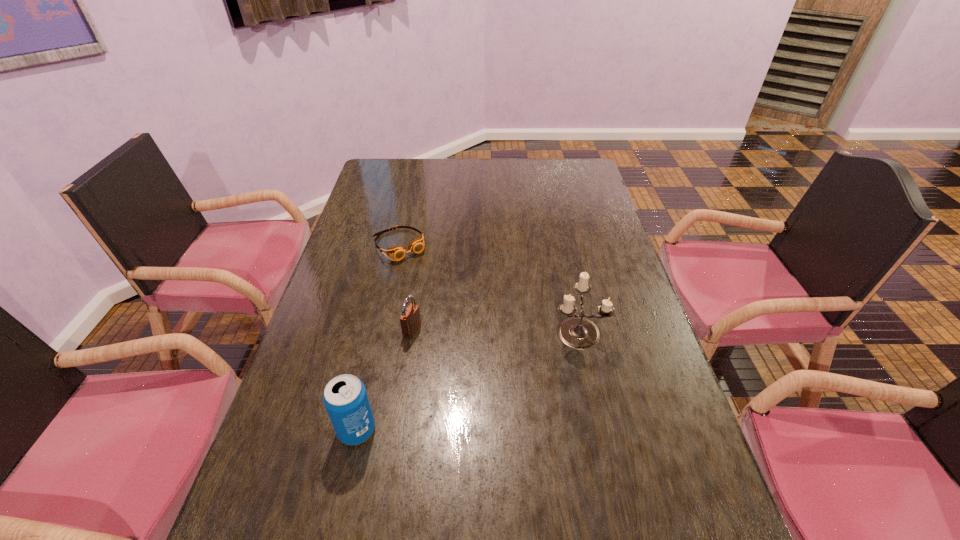
The width and height of the screenshot is (960, 540). I want to click on the nearest object, so click(345, 397).

Image resolution: width=960 pixels, height=540 pixels. I want to click on the rightmost object, so click(576, 332).

Find the location of `the second shortest object`. the second shortest object is located at coordinates (410, 320).

What are the coordinates of `the shortest object` in the screenshot? It's located at (417, 245).

At what (x,y) coordinates should I click in order to perform the action: click on goggles. Please return your answer as a coordinate pair (x, y). The width and height of the screenshot is (960, 540). Looking at the image, I should click on click(417, 245).

You are a GUI agent. You are given a task and a screenshot of the screen. Output one action in this format:
    pyautogui.click(x=<x>, y=<y>)
    Task: Click on the vacant space located on the back of the nearest object
    
    Given the screenshot: What is the action you would take?
    click(366, 390)

This screenshot has height=540, width=960. What are the coordinates of `vacant position located on the front of the candle holder` in the screenshot? It's located at (587, 373).

Image resolution: width=960 pixels, height=540 pixels. Find the location of `free spot located 0.100m on the front-facing side of the second shortest object`. free spot located 0.100m on the front-facing side of the second shortest object is located at coordinates (454, 345).

Where is `free space located 0.370m on the front-facing side of the second shortest object`? free space located 0.370m on the front-facing side of the second shortest object is located at coordinates (557, 379).

The height and width of the screenshot is (540, 960). Find the location of `vacant space located on the front-facing side of the second shortest object`. vacant space located on the front-facing side of the second shortest object is located at coordinates (450, 343).